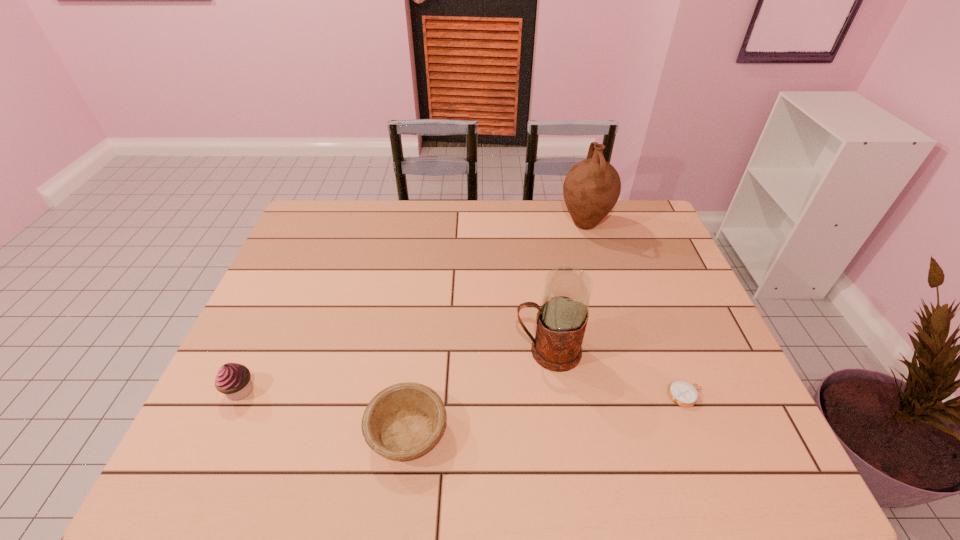
I want to click on free space between the bowl and the shortest object, so click(x=546, y=413).

Identify the location of free space between the third tallest object and the tallest object. Image resolution: width=960 pixels, height=540 pixels. (413, 307).

Locate an element on the screen. This screenshot has height=540, width=960. free spot between the leftmost object and the nearer pitcher is located at coordinates (394, 371).

Locate an element on the screen. free point between the tallest object and the second object from left to right is located at coordinates (496, 328).

Identify the location of empty location between the nearer pitcher and the bowl. (477, 392).

Point out which object is positioned as the second nearest to the taller pitcher. Please provide its 2D coordinates. Your answer should be formatted as a tuple, i.e. [(x, y)], where the tuple contains the x and y coordinates of a point satisfying the conditions above.

[(683, 393)]

Where is `the fourth closest object relative to the compass`? This screenshot has width=960, height=540. the fourth closest object relative to the compass is located at coordinates (234, 380).

Locate an element on the screen. free point that satisfies the following two spatial constraints: 1. with the handle on the side of the shortest object; 2. on the right side of the third object from right to left is located at coordinates (554, 395).

This screenshot has height=540, width=960. I want to click on free space that satisfies the following two spatial constraints: 1. with the handle on the side of the shorter pitcher; 2. on the front side of the bowl, so click(559, 431).

Find the location of a particular element. Image resolution: width=960 pixels, height=540 pixels. blank area in the image that satisfies the following two spatial constraints: 1. on the back side of the leftmost object; 2. on the right side of the farther pitcher is located at coordinates (316, 224).